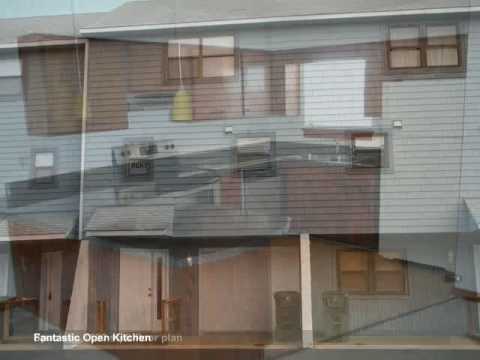
Where is `picture of a kitchen and house with a big glare over top of it`? picture of a kitchen and house with a big glare over top of it is located at coordinates (409, 111), (404, 194), (214, 191), (90, 199), (36, 229), (273, 273), (380, 267).